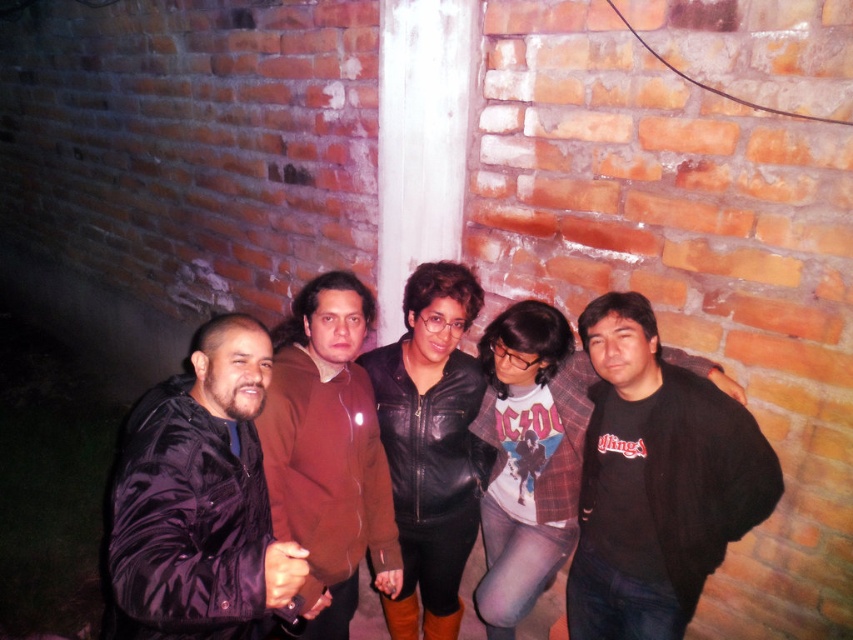
You are a photographer trying to focus on the shiny black jacket at center and the brown sweater at center in the image. Which one is positioned lower in the frame?

The shiny black jacket at center is positioned lower than the brown sweater at center in the frame.

You are standing in front of the group and see the point at position [656,481]. Which object from the scene does this point belong to?

The point at [656,481] is on the black cotton t shirt at center.